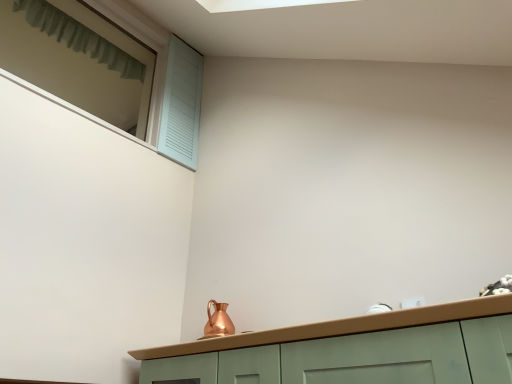
Question: Is copper metallic pitcher at center surrounded by light blue wooden shutter at upper left?

Choices:
 (A) yes
 (B) no

Answer: (B)

Question: Is light blue wooden shutter at upper left positioned behind copper metallic pitcher at center?

Choices:
 (A) yes
 (B) no

Answer: (A)

Question: Considering the relative sizes of light blue wooden shutter at upper left and copper metallic pitcher at center in the image provided, is light blue wooden shutter at upper left smaller than copper metallic pitcher at center?

Choices:
 (A) no
 (B) yes

Answer: (A)

Question: From a real-world perspective, does light blue wooden shutter at upper left sit lower than copper metallic pitcher at center?

Choices:
 (A) no
 (B) yes

Answer: (A)

Question: Is light blue wooden shutter at upper left at the right side of copper metallic pitcher at center?

Choices:
 (A) yes
 (B) no

Answer: (B)

Question: Considering the relative sizes of light blue wooden shutter at upper left and copper metallic pitcher at center in the image provided, is light blue wooden shutter at upper left shorter than copper metallic pitcher at center?

Choices:
 (A) yes
 (B) no

Answer: (B)

Question: Does green fabric curtain at upper left have a lesser height compared to light blue wooden shutter at upper left?

Choices:
 (A) no
 (B) yes

Answer: (B)

Question: Can you confirm if green fabric curtain at upper left is taller than light blue wooden shutter at upper left?

Choices:
 (A) yes
 (B) no

Answer: (B)

Question: From a real-world perspective, does green fabric curtain at upper left sit lower than light blue wooden shutter at upper left?

Choices:
 (A) yes
 (B) no

Answer: (B)

Question: Does green fabric curtain at upper left have a lesser width compared to light blue wooden shutter at upper left?

Choices:
 (A) yes
 (B) no

Answer: (A)

Question: Is green fabric curtain at upper left smaller than light blue wooden shutter at upper left?

Choices:
 (A) no
 (B) yes

Answer: (B)

Question: Can you confirm if green fabric curtain at upper left is positioned to the left of light blue wooden shutter at upper left?

Choices:
 (A) yes
 (B) no

Answer: (A)

Question: Is copper metallic pitcher at center oriented away from light blue wooden shutter at upper left?

Choices:
 (A) yes
 (B) no

Answer: (B)